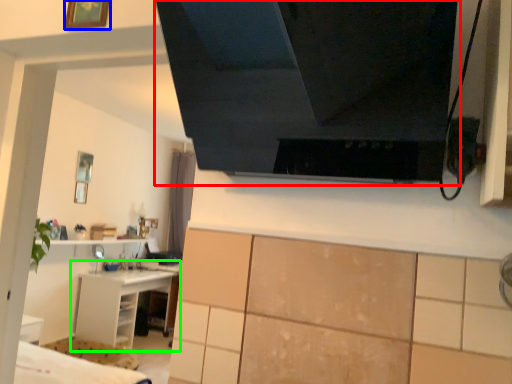
Question: Which object is positioned closest to exhaust hood (highlighted by a red box)? Select from picture frame (highlighted by a blue box) and shelf (highlighted by a green box).

Choices:
 (A) picture frame
 (B) shelf

Answer: (A)